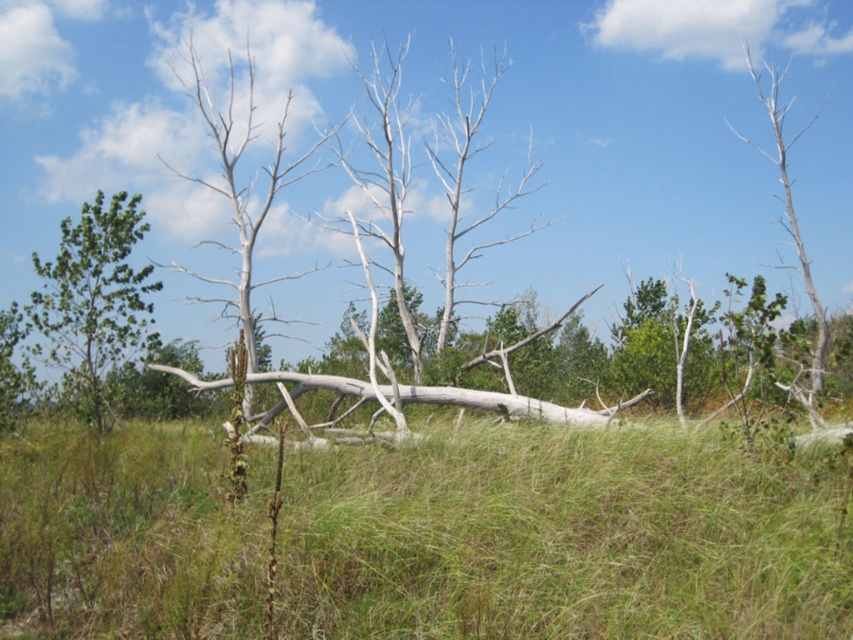
You are a bird looking for a nesting spot. You see the green leafy tree at left and the gray bark tree at upper right. Which tree is taller and would provide a better vantage point?

The gray bark tree at upper right is taller than the green leafy tree at left, so it would provide a better vantage point.